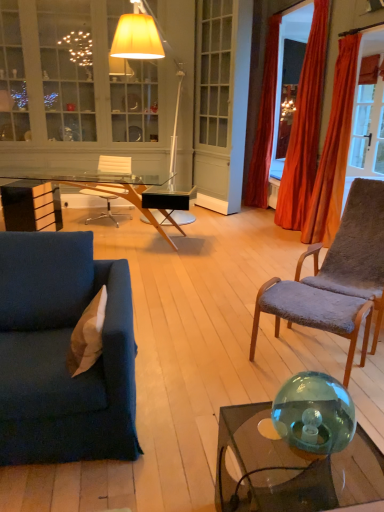
Where is `free region on the left part of gray plush chair at right, which appears as the 1th chair when viewed from the right`? free region on the left part of gray plush chair at right, which appears as the 1th chair when viewed from the right is located at coordinates (233, 320).